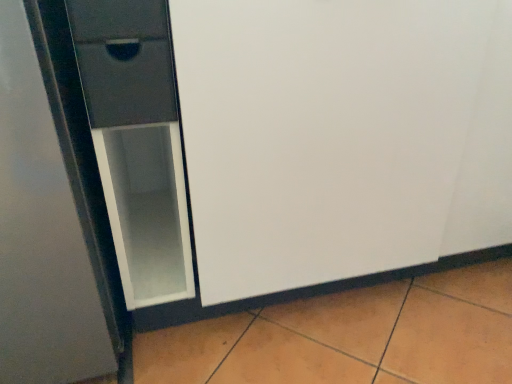
What is the approximate width of matte black drawer at left, which is the 2th drawer from top to bottom?

It is 39.42 centimeters.

What do you see at coordinates (117, 20) in the screenshot?
I see `matte black drawer at upper left, the 1th drawer when ordered from top to bottom` at bounding box center [117, 20].

This screenshot has height=384, width=512. What do you see at coordinates (322, 134) in the screenshot?
I see `matte glass screen door at left` at bounding box center [322, 134].

Locate an element on the screen. The height and width of the screenshot is (384, 512). matte black drawer at left, which appears as the 1th drawer when ordered from the bottom is located at coordinates (124, 61).

Consider the image. Considering the sizes of matte glass screen door at left and matte black drawer at left, which is the 2th drawer from top to bottom, in the image, is matte glass screen door at left wider or thinner than matte black drawer at left, which is the 2th drawer from top to bottom,?

Clearly, matte glass screen door at left has more width compared to matte black drawer at left, which is the 2th drawer from top to bottom.

Is point (326, 36) positioned after point (174, 98)?

That is True.

Which of these two, matte glass screen door at left or matte black drawer at left, which is the 2th drawer from top to bottom, is bigger?

matte glass screen door at left.

From a real-world perspective, is matte glass screen door at left physically above matte black drawer at left, which appears as the 1th drawer when ordered from the bottom?

No.

Considering the relative positions of matte black drawer at upper left, the second drawer from the bottom, and matte glass screen door at left in the image provided, is matte black drawer at upper left, the second drawer from the bottom, in front of matte glass screen door at left?

No.

In the scene shown: How different are the orientations of matte black drawer at upper left, the second drawer from the bottom, and matte glass screen door at left in degrees?

There is a 0.000271-degree angle between the facing directions of matte black drawer at upper left, the second drawer from the bottom, and matte glass screen door at left.

Is matte black drawer at upper left, the 1th drawer when ordered from top to bottom, aimed at matte glass screen door at left?

Yes, matte black drawer at upper left, the 1th drawer when ordered from top to bottom, is aimed at matte glass screen door at left.

Where is `the 2nd drawer positioned above the matte glass screen door at left (from the image's perspective)`? This screenshot has height=384, width=512. the 2nd drawer positioned above the matte glass screen door at left (from the image's perspective) is located at coordinates (117, 20).

What's the angular difference between matte black drawer at upper left, the second drawer from the bottom, and matte black drawer at left, which appears as the 1th drawer when ordered from the bottom,'s facing directions?

The angular difference between matte black drawer at upper left, the second drawer from the bottom, and matte black drawer at left, which appears as the 1th drawer when ordered from the bottom, is 0.000318 degrees.

Is point (135, 29) closer or farther from the camera than point (133, 82)?

Point (135, 29).

Could matte black drawer at left, which appears as the 1th drawer when ordered from the bottom, be considered to be inside matte black drawer at upper left, the second drawer from the bottom?

Definitely not — matte black drawer at left, which appears as the 1th drawer when ordered from the bottom, is not inside matte black drawer at upper left, the second drawer from the bottom.

Is matte black drawer at upper left, the second drawer from the bottom, aimed at matte black drawer at left, which is the 2th drawer from top to bottom?

No, matte black drawer at upper left, the second drawer from the bottom, does not turn towards matte black drawer at left, which is the 2th drawer from top to bottom.

Considering the relative sizes of matte black drawer at left, which is the 2th drawer from top to bottom, and matte black drawer at upper left, the second drawer from the bottom, in the image provided, is matte black drawer at left, which is the 2th drawer from top to bottom, thinner than matte black drawer at upper left, the second drawer from the bottom,?

Indeed, matte black drawer at left, which is the 2th drawer from top to bottom, has a lesser width compared to matte black drawer at upper left, the second drawer from the bottom.

Are matte black drawer at left, which appears as the 1th drawer when ordered from the bottom, and matte black drawer at upper left, the second drawer from the bottom, located far from each other?

matte black drawer at left, which appears as the 1th drawer when ordered from the bottom, is actually quite close to matte black drawer at upper left, the second drawer from the bottom.

Where is `drawer below the matte black drawer at upper left, the 1th drawer when ordered from top to bottom (from the image's perspective)`? drawer below the matte black drawer at upper left, the 1th drawer when ordered from top to bottom (from the image's perspective) is located at coordinates (124, 61).

In the scene shown: Would you say matte glass screen door at left is inside or outside matte black drawer at upper left, the second drawer from the bottom?

matte glass screen door at left is spatially situated outside matte black drawer at upper left, the second drawer from the bottom.

From the image's perspective, is matte glass screen door at left below matte black drawer at upper left, the second drawer from the bottom?

Indeed, from the image's perspective, matte glass screen door at left is shown beneath matte black drawer at upper left, the second drawer from the bottom.

From a real-world perspective, is matte glass screen door at left beneath matte black drawer at upper left, the 1th drawer when ordered from top to bottom?

Yes, from a real-world perspective, matte glass screen door at left is below matte black drawer at upper left, the 1th drawer when ordered from top to bottom.

Does matte glass screen door at left have a greater height compared to matte black drawer at upper left, the second drawer from the bottom?

Indeed, matte glass screen door at left has a greater height compared to matte black drawer at upper left, the second drawer from the bottom.

Considering the sizes of objects matte black drawer at left, which appears as the 1th drawer when ordered from the bottom, and matte glass screen door at left in the image provided, who is thinner, matte black drawer at left, which appears as the 1th drawer when ordered from the bottom, or matte glass screen door at left?

Thinner between the two is matte black drawer at left, which appears as the 1th drawer when ordered from the bottom.

From a real-world perspective, relative to matte glass screen door at left, is matte black drawer at left, which appears as the 1th drawer when ordered from the bottom, vertically above or below?

Clearly, from a real-world perspective, matte black drawer at left, which appears as the 1th drawer when ordered from the bottom, is above matte glass screen door at left.

Between matte black drawer at left, which appears as the 1th drawer when ordered from the bottom, and matte glass screen door at left, which one appears on the right side from the viewer's perspective?

matte glass screen door at left is more to the right.

Looking at this image, looking at the image, does matte black drawer at left, which is the 2th drawer from top to bottom, seem bigger or smaller compared to matte glass screen door at left?

Clearly, matte black drawer at left, which is the 2th drawer from top to bottom, is smaller in size than matte glass screen door at left.

From a real-world perspective, starting from the matte glass screen door at left, which drawer is the 1st one vertically above it? Please provide its 2D coordinates.

[(124, 61)]

From the matte glass screen door at left, count 1st drawers backward and point to it. Please provide its 2D coordinates.

[(117, 20)]

Which object lies further to the anchor point matte black drawer at upper left, the 1th drawer when ordered from top to bottom, matte glass screen door at left or matte black drawer at left, which is the 2th drawer from top to bottom?

Among the two, matte glass screen door at left is located further to matte black drawer at upper left, the 1th drawer when ordered from top to bottom.

When comparing their distances from matte black drawer at upper left, the second drawer from the bottom, does matte black drawer at left, which appears as the 1th drawer when ordered from the bottom, or matte glass screen door at left seem closer?

Among the two, matte black drawer at left, which appears as the 1th drawer when ordered from the bottom, is located nearer to matte black drawer at upper left, the second drawer from the bottom.

Looking at the image, which one is located further to matte glass screen door at left, matte black drawer at upper left, the 1th drawer when ordered from top to bottom, or matte black drawer at left, which is the 2th drawer from top to bottom?

The object further to matte glass screen door at left is matte black drawer at upper left, the 1th drawer when ordered from top to bottom.

Which object lies nearer to the anchor point matte glass screen door at left, matte black drawer at left, which appears as the 1th drawer when ordered from the bottom, or matte black drawer at upper left, the second drawer from the bottom?

Based on the image, matte black drawer at left, which appears as the 1th drawer when ordered from the bottom, appears to be nearer to matte glass screen door at left.

Estimate the real-world distances between objects in this image. Which object is closer to matte black drawer at left, which is the 2th drawer from top to bottom, matte black drawer at upper left, the second drawer from the bottom, or matte glass screen door at left?

matte black drawer at upper left, the second drawer from the bottom, is closer to matte black drawer at left, which is the 2th drawer from top to bottom.

Based on their spatial positions, is matte glass screen door at left or matte black drawer at upper left, the 1th drawer when ordered from top to bottom, closer to matte black drawer at left, which is the 2th drawer from top to bottom?

Based on the image, matte black drawer at upper left, the 1th drawer when ordered from top to bottom, appears to be nearer to matte black drawer at left, which is the 2th drawer from top to bottom.

Locate an element on the screen. Image resolution: width=512 pixels, height=384 pixels. drawer located between matte black drawer at upper left, the 1th drawer when ordered from top to bottom, and matte glass screen door at left in the left-right direction is located at coordinates (124, 61).